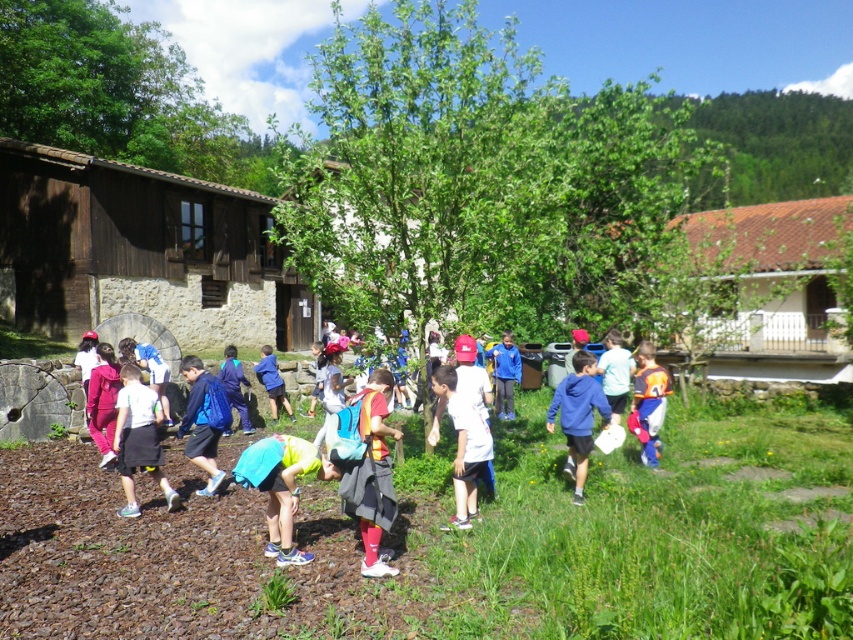
Question: Does white matte shirt at center come in front of orange fabric backpack at right?

Choices:
 (A) yes
 (B) no

Answer: (A)

Question: Which of these objects is positioned farthest from the white matte shirt at center?

Choices:
 (A) blue fabric backpack at center
 (B) white matte shorts at lower left

Answer: (B)

Question: Does white matte shorts at lower left come in front of orange fabric backpack at right?

Choices:
 (A) no
 (B) yes

Answer: (B)

Question: Which point is closer to the camera?

Choices:
 (A) (125, 513)
 (B) (645, 412)
 (C) (250, 484)

Answer: (C)

Question: Can you confirm if light blue fabric at center is positioned to the left of white matte shirt at center?

Choices:
 (A) yes
 (B) no

Answer: (A)

Question: Which object is the closest to the blue fabric backpack at center?

Choices:
 (A) light blue fabric at center
 (B) white matte shorts at lower left
 (C) white matte shirt at center
 (D) blue fleece jacket at center

Answer: (B)